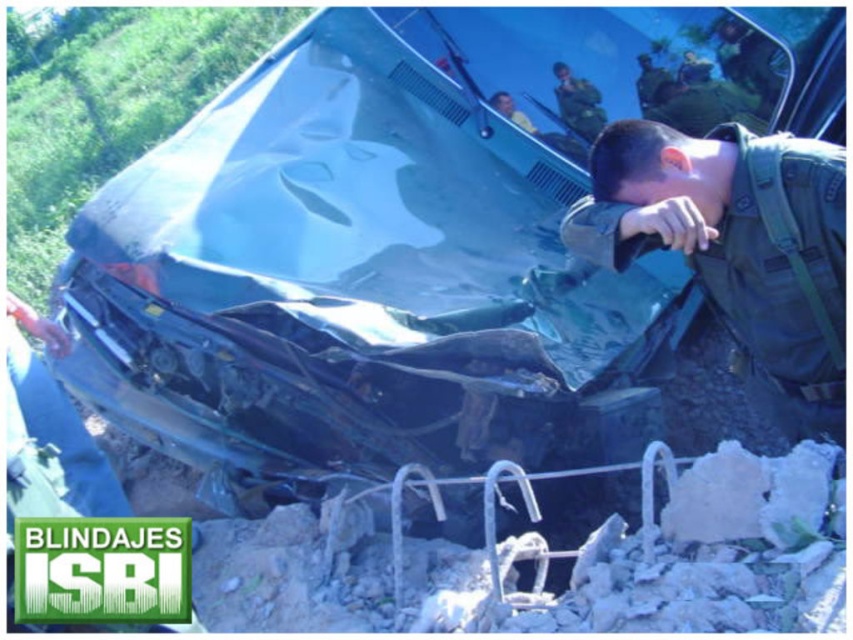
Measure the distance from dark green uniform at center to green matte uniform at upper center.

The distance of dark green uniform at center from green matte uniform at upper center is 3.72 feet.

Is dark green uniform at center taller than green matte uniform at upper center?

Correct, dark green uniform at center is much taller as green matte uniform at upper center.

Which is behind, point (805, 412) or point (563, 120)?

Positioned behind is point (563, 120).

Locate an element on the screen. The width and height of the screenshot is (853, 640). dark green uniform at center is located at coordinates (737, 246).

Can you confirm if dark green uniform at center is smaller than glossy glass windshield at upper center?

Indeed, dark green uniform at center has a smaller size compared to glossy glass windshield at upper center.

Between point (750, 168) and point (682, 90), which one is positioned behind?

The point (682, 90) is more distant.

I want to click on dark green uniform at center, so click(x=737, y=246).

Which of these two, glossy glass windshield at upper center or green matte uniform at upper center, stands shorter?

With less height is green matte uniform at upper center.

The width and height of the screenshot is (853, 640). Identify the location of glossy glass windshield at upper center. (602, 65).

Between point (589, 129) and point (596, 120), which one is positioned behind?

Positioned behind is point (589, 129).

Find the location of `glossy glass windshield at upper center`. glossy glass windshield at upper center is located at coordinates (602, 65).